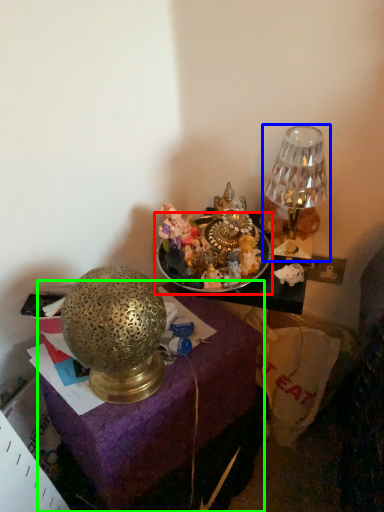
Question: Estimate the real-world distances between objects in this image. Which object is farther from tableware (highlighted by a red box), lamp (highlighted by a blue box) or furniture (highlighted by a green box)?

Choices:
 (A) lamp
 (B) furniture

Answer: (B)